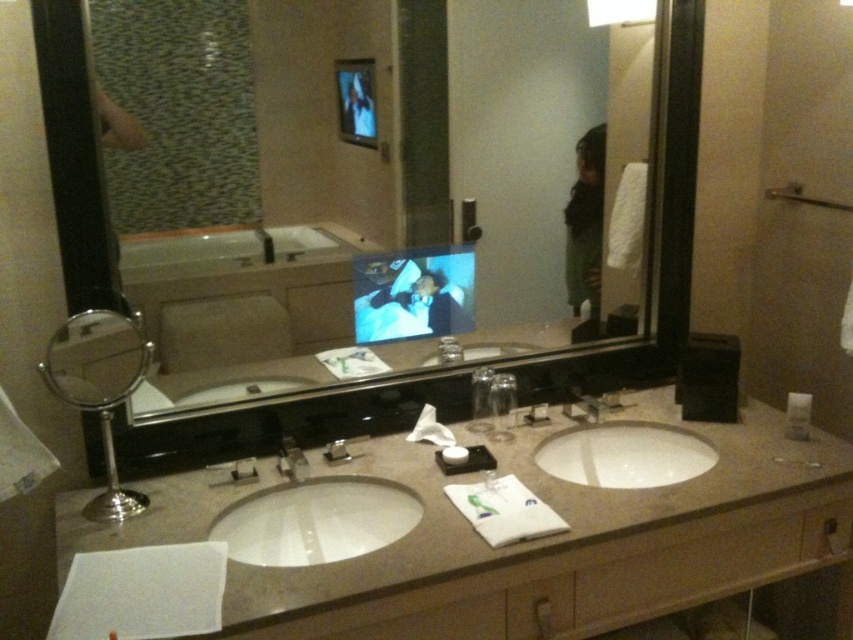
You are organizing items on the bathroom vanity. You need to place a new toothbrush holder between the white plastic soap at right and the brushed metal faucet at sink center. Based on their positions, where should you place the toothbrush holder?

The toothbrush holder should be placed between the white plastic soap at right and the brushed metal faucet at sink center, to the right of the faucet and to the left of the soap since the soap is positioned to the right of the faucet.

You are designing a layout for a bathroom counter and have to place the white plastic soap at right and the brushed metal faucet at sink center. Considering their sizes, which item will occupy more space horizontally on the counter?

The brushed metal faucet at sink center has a greater width than the white plastic soap at right, so it will occupy more horizontal space on the counter.

You are standing in the bathroom and want to reach both the point at coordinates point (x=572, y=451) and the point at coordinates point (x=792, y=392). Which point will you reach first?

You will reach the point at coordinates point (x=572, y=451) first because it is closer to you than the point at coordinates point (x=792, y=392).